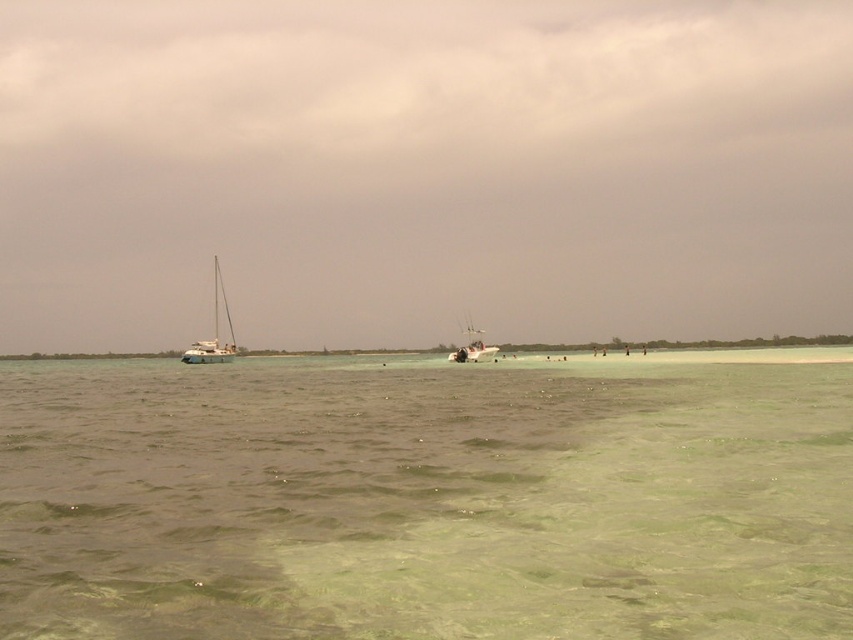
Is green translucent water at center behind white matte boat at center?

No, it is not.

In the scene shown: Can you confirm if green translucent water at center is wider than white matte boat at center?

Yes, green translucent water at center is wider than white matte boat at center.

Image resolution: width=853 pixels, height=640 pixels. Describe the element at coordinates (428, 497) in the screenshot. I see `green translucent water at center` at that location.

In order to click on green translucent water at center in this screenshot , I will do `click(428, 497)`.

Who is taller, white matte sailboat at left or white matte boat at center?

With more height is white matte sailboat at left.

Based on the photo, between white matte sailboat at left and white matte boat at center, which one appears on the right side from the viewer's perspective?

From the viewer's perspective, white matte boat at center appears more on the right side.

Locate an element on the screen. Image resolution: width=853 pixels, height=640 pixels. white matte sailboat at left is located at coordinates (213, 330).

Is green translucent water at center to the left of white matte sailboat at left from the viewer's perspective?

In fact, green translucent water at center is to the right of white matte sailboat at left.

Who is positioned more to the right, green translucent water at center or white matte sailboat at left?

From the viewer's perspective, green translucent water at center appears more on the right side.

Which is in front, point (564, 410) or point (222, 310)?

Positioned in front is point (564, 410).

Image resolution: width=853 pixels, height=640 pixels. I want to click on green translucent water at center, so click(428, 497).